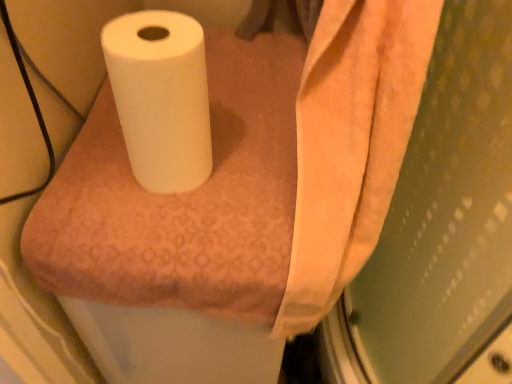
Question: Are white matte paper towel at center and white matte toilet paper at center making contact?

Choices:
 (A) no
 (B) yes

Answer: (A)

Question: Considering the relative positions of white matte paper towel at center and white matte toilet paper at center in the image provided, is white matte paper towel at center behind white matte toilet paper at center?

Choices:
 (A) no
 (B) yes

Answer: (B)

Question: Is white matte paper towel at center taller than white matte toilet paper at center?

Choices:
 (A) no
 (B) yes

Answer: (B)

Question: Considering the relative sizes of white matte paper towel at center and white matte toilet paper at center in the image provided, is white matte paper towel at center shorter than white matte toilet paper at center?

Choices:
 (A) no
 (B) yes

Answer: (A)

Question: Is white matte toilet paper at center inside white matte paper towel at center?

Choices:
 (A) no
 (B) yes

Answer: (A)

Question: Is white matte paper towel at center at the left side of white matte toilet paper at center?

Choices:
 (A) no
 (B) yes

Answer: (A)

Question: Is white matte toilet paper at center oriented away from white matte paper towel at center?

Choices:
 (A) no
 (B) yes

Answer: (A)

Question: Is white matte toilet paper at center positioned beyond the bounds of white matte paper towel at center?

Choices:
 (A) no
 (B) yes

Answer: (B)

Question: Can you confirm if white matte toilet paper at center is thinner than white matte paper towel at center?

Choices:
 (A) no
 (B) yes

Answer: (B)

Question: Is there a large distance between white matte toilet paper at center and white matte paper towel at center?

Choices:
 (A) yes
 (B) no

Answer: (B)

Question: Can you confirm if white matte toilet paper at center is taller than white matte paper towel at center?

Choices:
 (A) yes
 (B) no

Answer: (B)

Question: Is white matte toilet paper at center oriented towards white matte paper towel at center?

Choices:
 (A) no
 (B) yes

Answer: (A)

Question: Looking at their shapes, would you say white matte paper towel at center is wider or thinner than white matte toilet paper at center?

Choices:
 (A) wide
 (B) thin

Answer: (A)